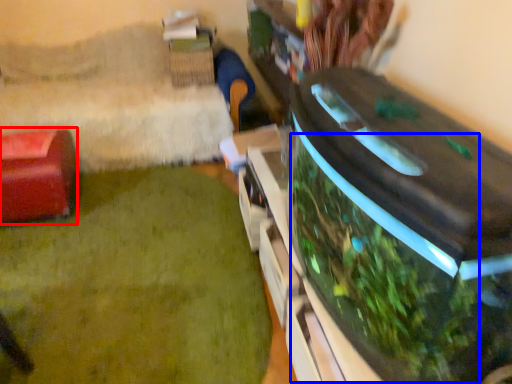
Question: Which point is further to the camera, furniture (highlighted by a red box) or vegetation (highlighted by a blue box)?

Choices:
 (A) furniture
 (B) vegetation

Answer: (A)